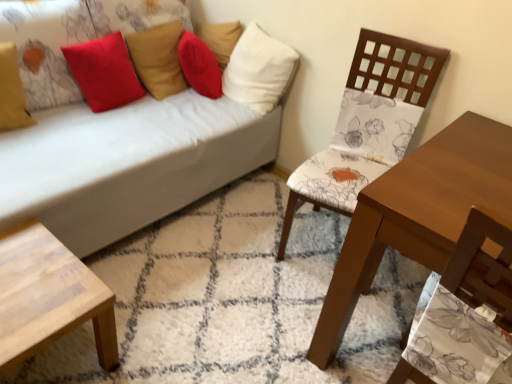
At what (x,y) coordinates should I click in order to perform the action: click on velvet red pillow at upper left, arranged as the second pillow when viewed from the right. Please return your answer as a coordinate pair (x, y). The width and height of the screenshot is (512, 384). Looking at the image, I should click on (104, 72).

How much space does matte yellow pillow at upper left, acting as the 1th pillow starting from the left, occupy vertically?

15.11 inches.

What do you see at coordinates (11, 91) in the screenshot? This screenshot has height=384, width=512. I see `matte yellow pillow at upper left, the fourth pillow viewed from the right` at bounding box center [11, 91].

What are the coordinates of `light wood/texture coffee table at lower left` in the screenshot? It's located at (48, 297).

The width and height of the screenshot is (512, 384). What do you see at coordinates (417, 214) in the screenshot? I see `wooden table at right` at bounding box center [417, 214].

Locate an element on the screen. The height and width of the screenshot is (384, 512). floral fabric chair at center right is located at coordinates (367, 125).

This screenshot has height=384, width=512. Describe the element at coordinates (367, 125) in the screenshot. I see `floral fabric chair at center right` at that location.

At what (x,y) coordinates should I click in order to perform the action: click on velvet red pillow at upper left, arranged as the second pillow when viewed from the right. Please return your answer as a coordinate pair (x, y). The image size is (512, 384). Looking at the image, I should click on (104, 72).

From the image's perspective, which one is positioned lower, red matte pillow at upper left, the 2th pillow when ordered from left to right, or light wood/texture coffee table at lower left?

From the image's view, light wood/texture coffee table at lower left is below.

Could you tell me if red matte pillow at upper left, the 3th pillow positioned from the right, is turned towards light wood/texture coffee table at lower left?

Yes.

Is red matte pillow at upper left, the 3th pillow positioned from the right, to the right of light wood/texture coffee table at lower left from the viewer's perspective?

Incorrect, red matte pillow at upper left, the 3th pillow positioned from the right, is not on the right side of light wood/texture coffee table at lower left.

Considering the points (57, 58) and (100, 335), which point is behind, point (57, 58) or point (100, 335)?

The point (57, 58) is behind.

From their relative heights in the image, would you say velvet red pillow at upper left, arranged as the second pillow when viewed from the right, is taller or shorter than matte yellow pillow at upper left, acting as the 1th pillow starting from the left?

velvet red pillow at upper left, arranged as the second pillow when viewed from the right, is taller than matte yellow pillow at upper left, acting as the 1th pillow starting from the left.

Which object is positioned more to the right, velvet red pillow at upper left, acting as the 3th pillow starting from the left, or matte yellow pillow at upper left, the fourth pillow viewed from the right?

velvet red pillow at upper left, acting as the 3th pillow starting from the left, is more to the right.

Locate an element on the screen. the 2nd pillow counting from the left side of the velvet red pillow at upper left, acting as the 3th pillow starting from the left is located at coordinates (11, 91).

Could you measure the distance between velvet red pillow at upper left, acting as the 3th pillow starting from the left, and matte yellow pillow at upper left, the fourth pillow viewed from the right?

velvet red pillow at upper left, acting as the 3th pillow starting from the left, and matte yellow pillow at upper left, the fourth pillow viewed from the right, are 14.01 inches apart.

Which object is closer to the camera taking this photo, white fabric pillow at upper center, which ranks as the 1th pillow in right-to-left order, or matte yellow pillow at upper left, the fourth pillow viewed from the right?

matte yellow pillow at upper left, the fourth pillow viewed from the right, is more forward.

Between white fabric pillow at upper center, arranged as the fourth pillow when viewed from the left, and matte yellow pillow at upper left, acting as the 1th pillow starting from the left, which one has less height?

Standing shorter between the two is matte yellow pillow at upper left, acting as the 1th pillow starting from the left.

Is white fabric pillow at upper center, which ranks as the 1th pillow in right-to-left order, located outside matte yellow pillow at upper left, the fourth pillow viewed from the right?

Yes, white fabric pillow at upper center, which ranks as the 1th pillow in right-to-left order, is located beyond the bounds of matte yellow pillow at upper left, the fourth pillow viewed from the right.

Is matte yellow pillow at upper left, acting as the 1th pillow starting from the left, smaller than red matte pillow at upper left, the 2th pillow when ordered from left to right?

Yes, matte yellow pillow at upper left, acting as the 1th pillow starting from the left, is smaller than red matte pillow at upper left, the 2th pillow when ordered from left to right.

Is matte yellow pillow at upper left, the fourth pillow viewed from the right, facing towards red matte pillow at upper left, the 3th pillow positioned from the right?

Yes, matte yellow pillow at upper left, the fourth pillow viewed from the right, is oriented towards red matte pillow at upper left, the 3th pillow positioned from the right.

How much distance is there between matte yellow pillow at upper left, the fourth pillow viewed from the right, and red matte pillow at upper left, the 3th pillow positioned from the right?

The distance of matte yellow pillow at upper left, the fourth pillow viewed from the right, from red matte pillow at upper left, the 3th pillow positioned from the right, is 21.29 centimeters.

Identify the location of chair that appears below the red matte pillow at upper left, the 3th pillow positioned from the right (from a real-world perspective). The image size is (512, 384). (367, 125).

Does floral fabric chair at center right contain red matte pillow at upper left, the 2th pillow when ordered from left to right?

No, red matte pillow at upper left, the 2th pillow when ordered from left to right, is not a part of floral fabric chair at center right.

From the image's perspective, is floral fabric chair at center right located beneath red matte pillow at upper left, the 2th pillow when ordered from left to right?

Yes.

How many degrees apart are the facing directions of floral fabric chair at center right and red matte pillow at upper left, the 3th pillow positioned from the right?

There is a 75.8-degree angle between the facing directions of floral fabric chair at center right and red matte pillow at upper left, the 3th pillow positioned from the right.

From a real-world perspective, is white fabric pillow at upper center, which ranks as the 1th pillow in right-to-left order, physically below light wood/texture coffee table at lower left?

Actually, white fabric pillow at upper center, which ranks as the 1th pillow in right-to-left order, is physically above light wood/texture coffee table at lower left in the real world.

What's the angular difference between white fabric pillow at upper center, which ranks as the 1th pillow in right-to-left order, and light wood/texture coffee table at lower left's facing directions?

89.9 degrees.

Does white fabric pillow at upper center, which ranks as the 1th pillow in right-to-left order, have a smaller size compared to light wood/texture coffee table at lower left?

Actually, white fabric pillow at upper center, which ranks as the 1th pillow in right-to-left order, might be larger than light wood/texture coffee table at lower left.

Is the position of white fabric pillow at upper center, which ranks as the 1th pillow in right-to-left order, less distant than that of light wood/texture coffee table at lower left?

No, white fabric pillow at upper center, which ranks as the 1th pillow in right-to-left order, is further to the viewer.

From the image's perspective, is wooden table at right below white fabric pillow at upper center, arranged as the fourth pillow when viewed from the left?

Yes, from the image's perspective, wooden table at right is beneath white fabric pillow at upper center, arranged as the fourth pillow when viewed from the left.

Based on the photo, considering the sizes of wooden table at right and white fabric pillow at upper center, arranged as the fourth pillow when viewed from the left, in the image, is wooden table at right bigger or smaller than white fabric pillow at upper center, arranged as the fourth pillow when viewed from the left,?

In the image, wooden table at right appears to be larger than white fabric pillow at upper center, arranged as the fourth pillow when viewed from the left.

From a real-world perspective, which is physically above, wooden table at right or white fabric pillow at upper center, which ranks as the 1th pillow in right-to-left order?

white fabric pillow at upper center, which ranks as the 1th pillow in right-to-left order, from a real-world perspective.

Considering the sizes of objects wooden table at right and white fabric pillow at upper center, arranged as the fourth pillow when viewed from the left, in the image provided, who is wider, wooden table at right or white fabric pillow at upper center, arranged as the fourth pillow when viewed from the left,?

With larger width is wooden table at right.

Find the location of a particular element. coffee table below the red matte pillow at upper left, the 3th pillow positioned from the right (from a real-world perspective) is located at coordinates (48, 297).

Which pillow is the 2nd one when counting from the back of the matte yellow pillow at upper left, acting as the 1th pillow starting from the left? Please provide its 2D coordinates.

[(104, 72)]

When comparing their distances from floral fabric chair at center right, does white fabric pillow at upper center, which ranks as the 1th pillow in right-to-left order, or velvet red pillow at upper left, acting as the 3th pillow starting from the left, seem closer?

white fabric pillow at upper center, which ranks as the 1th pillow in right-to-left order, is positioned closer to the anchor floral fabric chair at center right.

From the image, which object appears to be farther from red matte pillow at upper left, the 3th pillow positioned from the right, matte yellow pillow at upper left, acting as the 1th pillow starting from the left, or white fabric couch at upper left?

white fabric couch at upper left is further to red matte pillow at upper left, the 3th pillow positioned from the right.

From the image, which object appears to be farther from white fabric pillow at upper center, arranged as the fourth pillow when viewed from the left, floral fabric chair at center right or light wood/texture coffee table at lower left?

Based on the image, light wood/texture coffee table at lower left appears to be further to white fabric pillow at upper center, arranged as the fourth pillow when viewed from the left.

Considering their positions, is wooden table at right positioned closer to velvet red pillow at upper left, acting as the 3th pillow starting from the left, than matte yellow pillow at upper left, the fourth pillow viewed from the right?

matte yellow pillow at upper left, the fourth pillow viewed from the right, is positioned closer to the anchor velvet red pillow at upper left, acting as the 3th pillow starting from the left.

From the image, which object appears to be farther from wooden table at right, floral fabric chair at center right or red matte pillow at upper left, the 2th pillow when ordered from left to right?

Based on the image, red matte pillow at upper left, the 2th pillow when ordered from left to right, appears to be further to wooden table at right.

Estimate the real-world distances between objects in this image. Which object is closer to matte yellow pillow at upper left, the fourth pillow viewed from the right, velvet red pillow at upper left, arranged as the second pillow when viewed from the right, or white fabric couch at upper left?

velvet red pillow at upper left, arranged as the second pillow when viewed from the right, lies closer to matte yellow pillow at upper left, the fourth pillow viewed from the right, than the other object.

Based on their spatial positions, is white fabric couch at upper left or velvet red pillow at upper left, arranged as the second pillow when viewed from the right, closer to floral fabric chair at center right?

white fabric couch at upper left is positioned closer to the anchor floral fabric chair at center right.

When comparing their distances from floral fabric chair at center right, does white fabric couch at upper left or matte yellow pillow at upper left, acting as the 1th pillow starting from the left, seem further?

Based on the image, matte yellow pillow at upper left, acting as the 1th pillow starting from the left, appears to be further to floral fabric chair at center right.

Locate an element on the screen. This screenshot has height=384, width=512. studio couch between matte yellow pillow at upper left, acting as the 1th pillow starting from the left, and white fabric pillow at upper center, arranged as the fourth pillow when viewed from the left, in the horizontal direction is located at coordinates (127, 163).

I want to click on pillow located between matte yellow pillow at upper left, the fourth pillow viewed from the right, and velvet red pillow at upper left, arranged as the second pillow when viewed from the right, in the left-right direction, so click(51, 44).

Image resolution: width=512 pixels, height=384 pixels. I want to click on studio couch that lies between velvet red pillow at upper left, acting as the 3th pillow starting from the left, and light wood/texture coffee table at lower left from top to bottom, so click(127, 163).

At what (x,y) coordinates should I click in order to perform the action: click on chair between wooden table at right and white fabric pillow at upper center, arranged as the fourth pillow when viewed from the left, from front to back. Please return your answer as a coordinate pair (x, y). Looking at the image, I should click on (367, 125).